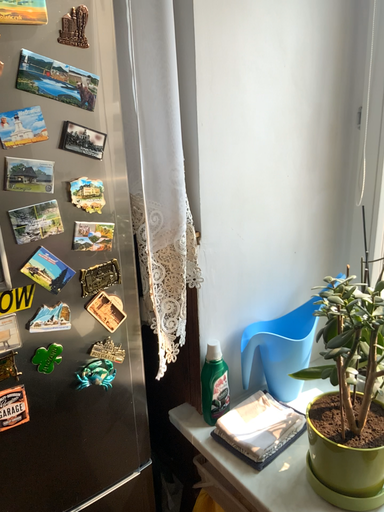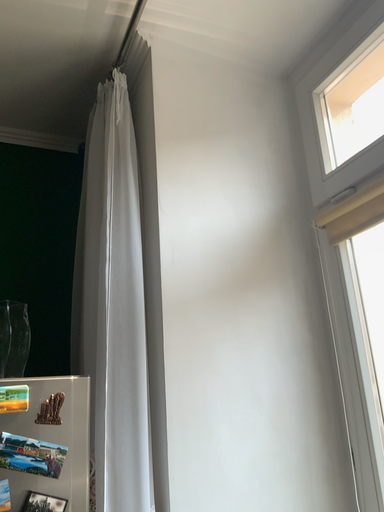
Question: Which way did the camera rotate in the video?

Choices:
 (A) rotated right
 (B) rotated left

Answer: (B)